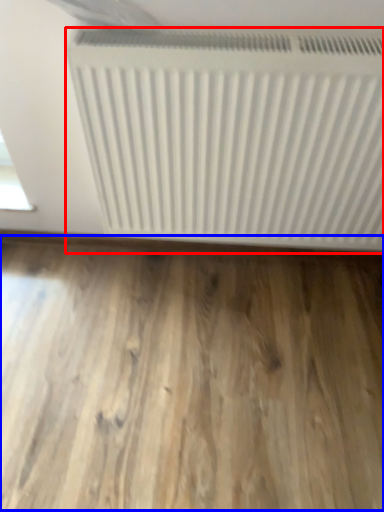
Question: Which of the following is the farthest to the observer, radiator (highlighted by a red box) or hardwood (highlighted by a blue box)?

Choices:
 (A) radiator
 (B) hardwood

Answer: (B)